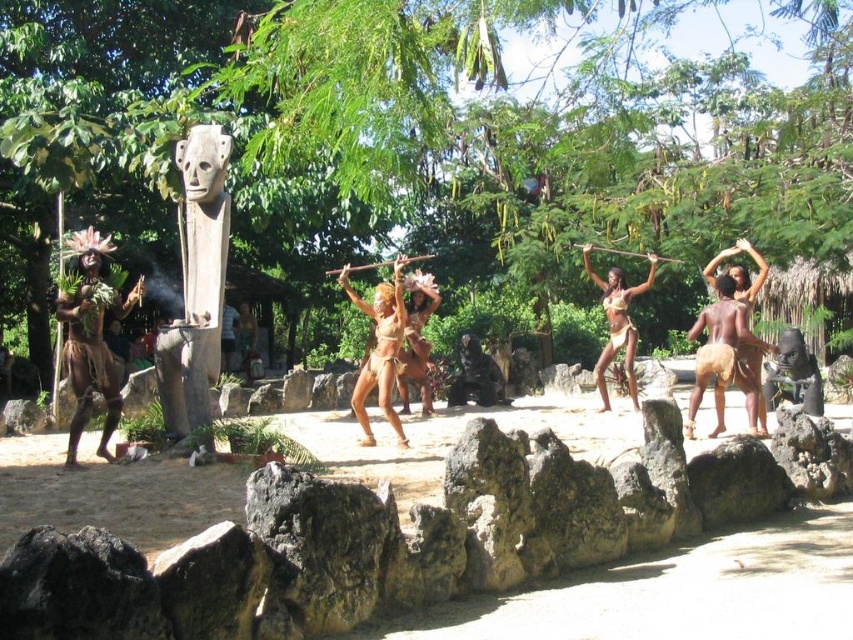
Is point (86, 268) less distant than point (393, 285)?

Yes.

Between point (97, 337) and point (357, 376), which one is positioned behind?

Positioned behind is point (357, 376).

Where is `brown textured grass skirt at left`? The image size is (853, 640). brown textured grass skirt at left is located at coordinates (91, 339).

Which is more to the left, brown textured skin at center or brown textured skirt at right?

Positioned to the left is brown textured skin at center.

Is point (381, 332) positioned behind point (747, 320)?

That is True.

In order to click on brown textured skin at center in this screenshot , I will do `click(379, 349)`.

Measure the distance between brown leather skirt at center and camera.

brown leather skirt at center and camera are 12.66 meters apart from each other.

From the picture: Can you confirm if brown leather skirt at center is positioned below brown textured skirt at right?

No.

What do you see at coordinates (618, 323) in the screenshot? I see `brown leather skirt at center` at bounding box center [618, 323].

You are a GUI agent. You are given a task and a screenshot of the screen. Output one action in this format:
    pyautogui.click(x=<x>, y=<y>)
    Task: Click on the brown leather skirt at center
    
    Given the screenshot: What is the action you would take?
    pyautogui.click(x=618, y=323)